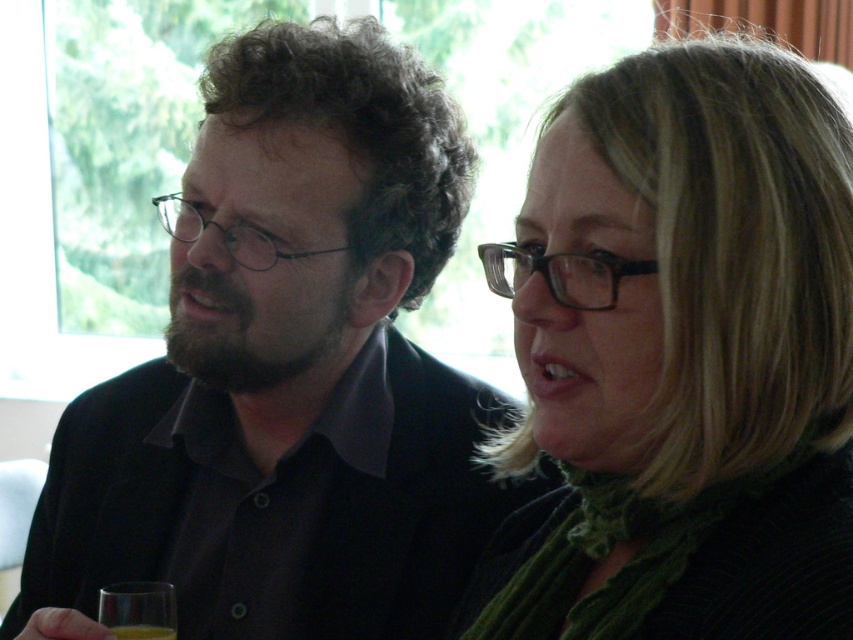
You are a photographer setting up for a portrait. You need to position a spotlight on the matte black shirt at center and another on the translucent yellow liquid at lower left. According to the scene description, which object should you place the spotlight closer to the left side of the frame?

The translucent yellow liquid at lower left should be placed closer to the left side of the frame since the matte black shirt at center is to the right of it.

You are a photographer standing 1 meter away from the two people in the image. You want to take a closeup photo of the matte black shirt at center and the green textured scarf at center without cropping either of them. What is the minimum width of the camera sensor you need?

The minimum width of the camera sensor needed is 38.41 centimeters to capture both the matte black shirt at center and the green textured scarf at center without cropping either.